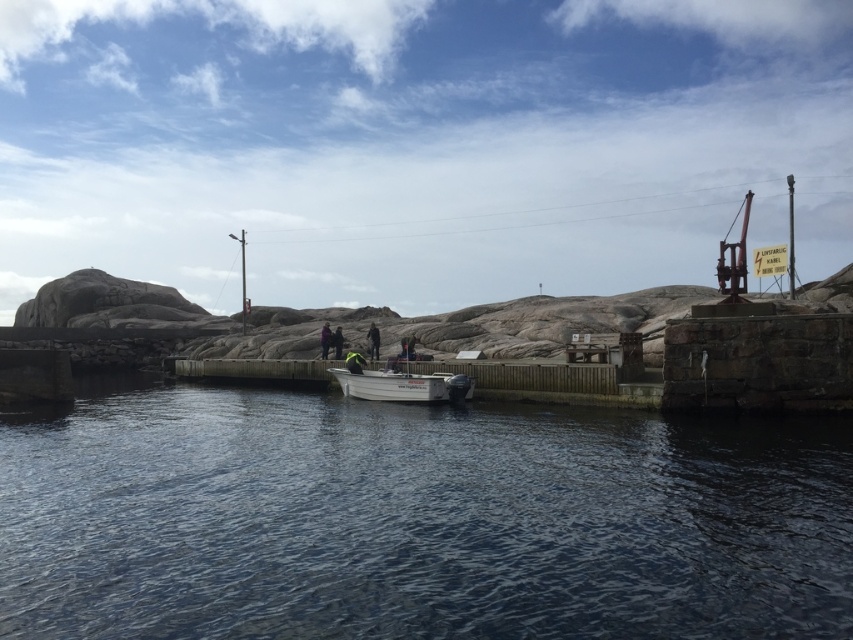
You are navigating a small boat and need to dock it at the pier. The white matte boat at center is currently at coordinates 0.600, 0.471. If the pier extends from coordinates 0.5 to 0.7 along the x and y axes, will the boat be within the pier area when it docks?

The white matte boat at center is located at point [401,384], which falls within the pier area extending from 0.5 to 0.7 on both axes. Therefore, the boat will be within the pier area when it docks.

You are a photographer positioned at the end of the pier. You want to capture a photo that includes both the dark blue water at center and the green fabric jacket at center. Based on their positions, which object should you adjust your camera to focus on first to ensure both are in the frame?

The dark blue water at center is in front of the green fabric jacket at center, so you should adjust your camera to focus on the dark blue water at center first to ensure both are in the frame.

You are a photographer standing on the pier and want to capture both the white matte boat at center and the dark blue jacket at center in the same frame. Since you can only adjust your camera angle slightly, which object should you aim the camera towards to ensure both are visible?

You should aim the camera towards the white matte boat at center because it is located below the dark blue jacket at center, so by pointing the camera downward slightly, both objects will be in the frame.